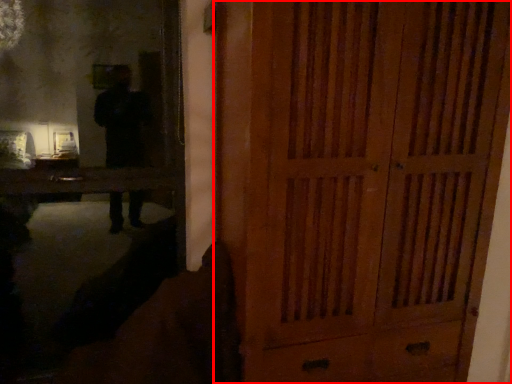
Question: From the image's perspective, where is door (annotated by the red box) located in relation to mirror in the image?

Choices:
 (A) below
 (B) above

Answer: (A)